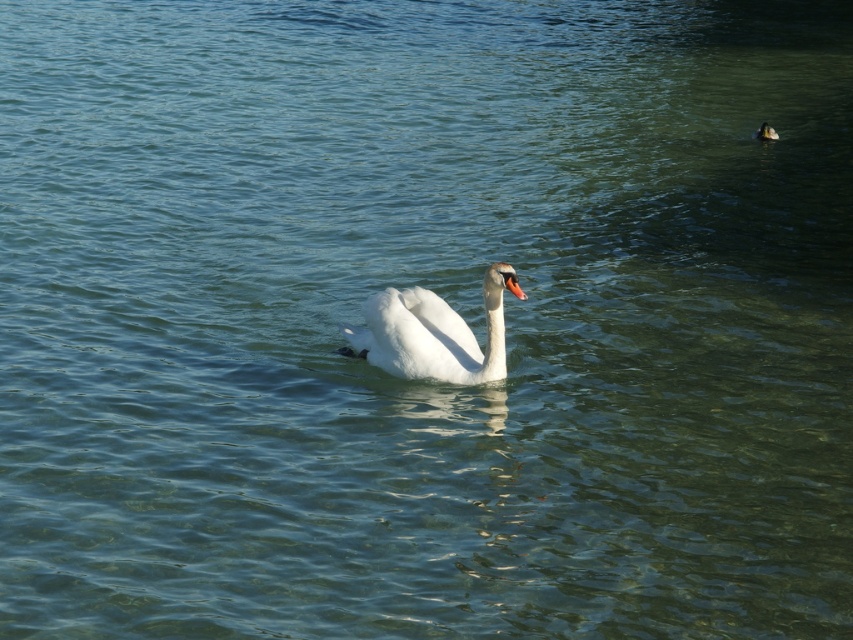
You are a photographer trying to capture the white glossy swan at center and the white matte duck at center in the same frame. Based on their positions, which one is closer to the water surface?

The white glossy swan at center is located below the white matte duck at center, so the swan is closer to the water surface.

You are a photographer trying to capture the white glossy swan at center and the white matte duck at center in the same frame. Which bird should you focus on first if you want to ensure both are in focus?

The white glossy swan at center is larger, so focusing on it first will help ensure both are in focus since it occupies more of the frame.

You are standing on a wooden pier that is 5 meters away from the water. You see the white glossy swan at center. Can you reach the swan with a 3.5 meter long fishing rod?

The white glossy swan at center is 7.92 meters from viewer. Since the pier is 5 meters away from the water, the total distance between you and the swan is 5 meters plus 7.92 meters equals 12.92 meters. The fishing rod is only 3.5 meters long, so you cannot reach the swan.